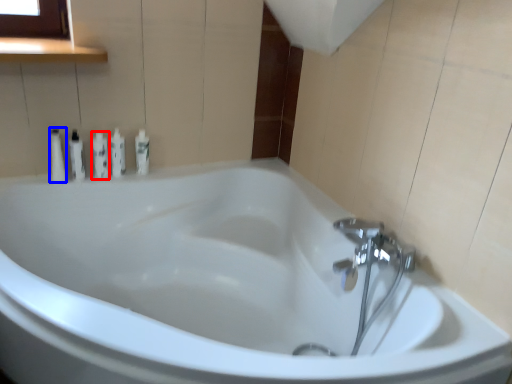
Question: Which object is closer to the camera taking this photo, toiletry (highlighted by a red box) or toiletry (highlighted by a blue box)?

Choices:
 (A) toiletry
 (B) toiletry

Answer: (B)